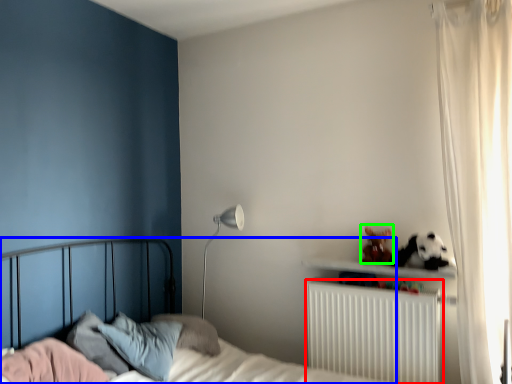
Question: Which object is the closest to the radiator (highlighted by a red box)? Choose among these: bed (highlighted by a blue box) or stuff (highlighted by a green box).

Choices:
 (A) bed
 (B) stuff

Answer: (B)